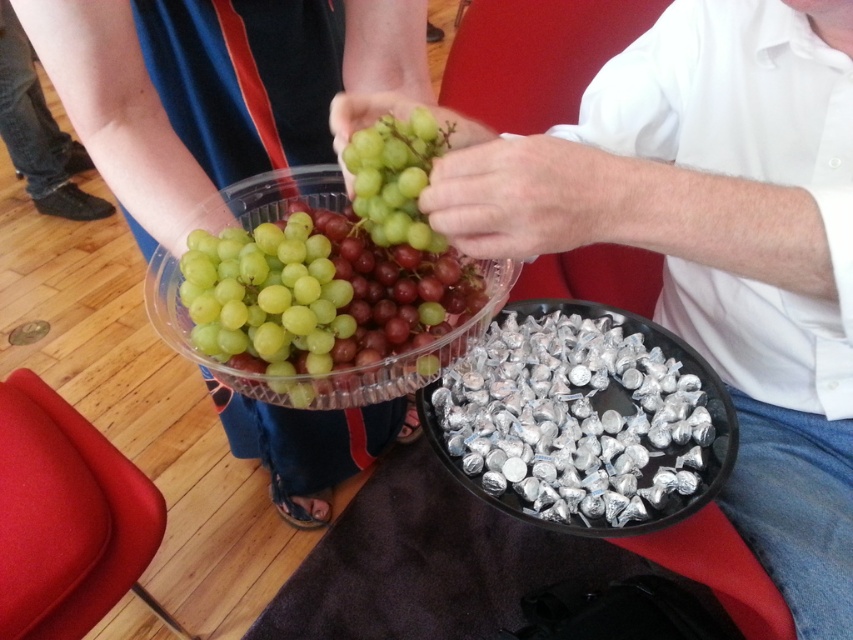
Consider the image. Is silver foil-wrapped chocolates at lower center thinner than jeans at lower left?

Indeed, silver foil-wrapped chocolates at lower center has a lesser width compared to jeans at lower left.

Who is taller, silver foil-wrapped chocolates at lower center or jeans at lower left?

Standing taller between the two is jeans at lower left.

Between point (630, 467) and point (54, 186), which one is positioned in front?

Point (630, 467) is more forward.

Where is `silver foil-wrapped chocolates at lower center`? This screenshot has width=853, height=640. silver foil-wrapped chocolates at lower center is located at coordinates click(583, 420).

Is point (265, 35) less distant than point (64, 147)?

Yes, point (265, 35) is closer to viewer.

This screenshot has height=640, width=853. I want to click on translucent plastic grapes at center, so coord(213,88).

What are the coordinates of `translucent plastic grapes at center` in the screenshot? It's located at (213, 88).

Between point (827, 532) and point (662, 333), which one is positioned in front?

Positioned in front is point (827, 532).

Does green matte grapes at upper left have a greater width compared to silver foil-wrapped chocolates at lower center?

Yes, green matte grapes at upper left is wider than silver foil-wrapped chocolates at lower center.

Does point (525, 182) come closer to viewer compared to point (592, 332)?

Yes, point (525, 182) is closer to viewer.

This screenshot has width=853, height=640. In order to click on green matte grapes at upper left in this screenshot , I will do `click(715, 244)`.